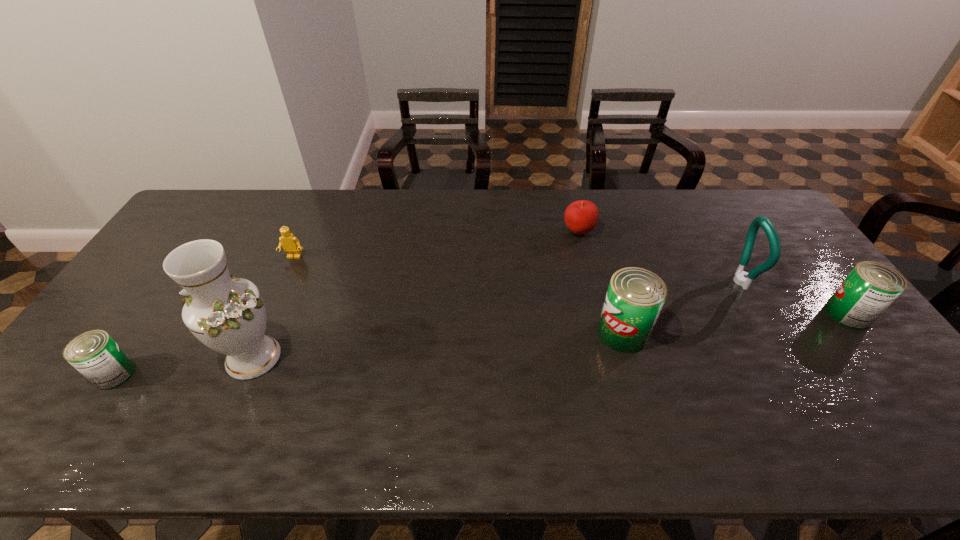
Locate an element on the screen. This screenshot has height=540, width=960. object that is positioned at the far edge is located at coordinates (581, 216).

At what (x,y) coordinates should I click in order to perform the action: click on can at the near edge. Please return your answer as a coordinate pair (x, y). This screenshot has width=960, height=540. Looking at the image, I should click on (94, 354).

This screenshot has height=540, width=960. I want to click on vase that is positioned at the near edge, so click(x=227, y=314).

You are a GUI agent. You are given a task and a screenshot of the screen. Output one action in this format:
    pyautogui.click(x=<x>, y=<y>)
    Task: Click on the object at the left edge
    This screenshot has height=540, width=960.
    Given the screenshot: What is the action you would take?
    pyautogui.click(x=94, y=354)

Locate an element on the screen. The width and height of the screenshot is (960, 540). object at the right edge is located at coordinates (870, 288).

Identify the location of object that is positioned at the near left corner. Image resolution: width=960 pixels, height=540 pixels. (94, 354).

You are a GUI agent. You are given a task and a screenshot of the screen. Output one action in this format:
    pyautogui.click(x=<x>, y=<y>)
    Task: Click on the free space at the far edge of the desktop
    The image size is (960, 540).
    Given the screenshot: What is the action you would take?
    pyautogui.click(x=519, y=220)

Where is `vacant space at the near edge`? Image resolution: width=960 pixels, height=540 pixels. vacant space at the near edge is located at coordinates (496, 387).

Image resolution: width=960 pixels, height=540 pixels. In the image, there is a desktop. What are the coordinates of `vacant region at the right edge` in the screenshot? It's located at (793, 255).

Image resolution: width=960 pixels, height=540 pixels. What are the coordinates of `vacant space at the near right corner of the desktop` in the screenshot? It's located at (862, 381).